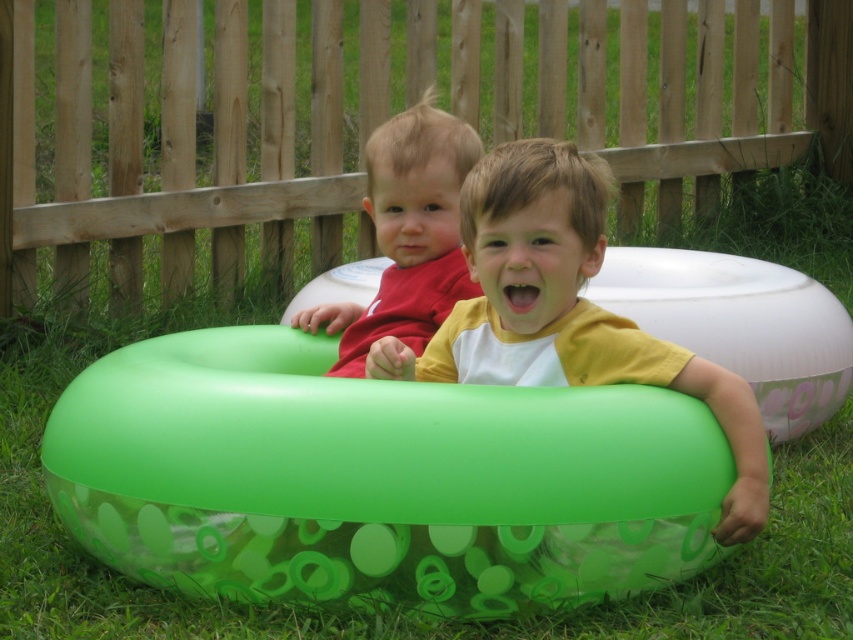
Question: Does green rubber ring at center appear on the right side of yellow matte shirt at center?

Choices:
 (A) yes
 (B) no

Answer: (B)

Question: Which point appears closest to the camera in this image?

Choices:
 (A) (572, 154)
 (B) (296, 316)
 (C) (619, 445)

Answer: (C)

Question: Which point appears closest to the camera in this image?

Choices:
 (A) (293, 476)
 (B) (653, 369)
 (C) (413, 248)

Answer: (A)

Question: Which is farther from the matte red shirt at center?

Choices:
 (A) green rubber ring at center
 (B) yellow matte shirt at center

Answer: (A)

Question: Does green rubber ring at center appear under yellow matte shirt at center?

Choices:
 (A) no
 (B) yes

Answer: (B)

Question: Is green rubber ring at center further to the viewer compared to matte red shirt at center?

Choices:
 (A) no
 (B) yes

Answer: (A)